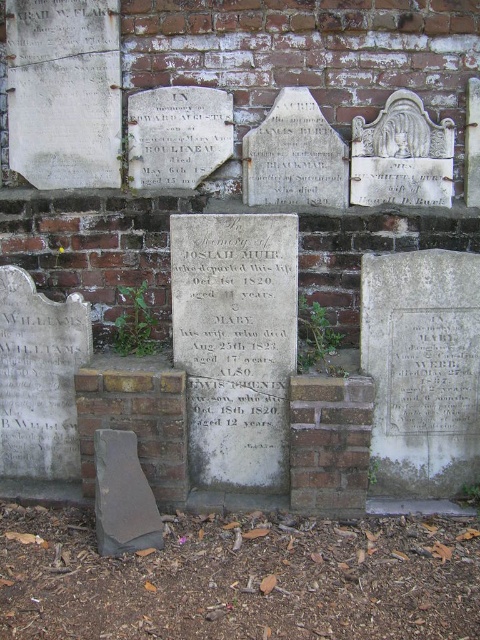
Consider the image. Is gray stone plaque at center to the right of white stone plaque at center from the viewer's perspective?

No, gray stone plaque at center is not to the right of white stone plaque at center.

Can you confirm if gray stone plaque at center is shorter than white stone plaque at center?

In fact, gray stone plaque at center may be taller than white stone plaque at center.

Which is behind, point (285, 330) or point (410, 120)?

The point (410, 120) is behind.

The height and width of the screenshot is (640, 480). What are the coordinates of `gray stone plaque at center` in the screenshot? It's located at (236, 340).

Who is lower down, white stone plaque at center or gray stone gravestone at lower left?

gray stone gravestone at lower left is lower down.

Does white stone plaque at center appear on the left side of gray stone gravestone at lower left?

No, white stone plaque at center is not to the left of gray stone gravestone at lower left.

Identify the location of white stone plaque at center. The width and height of the screenshot is (480, 640). (402, 156).

The height and width of the screenshot is (640, 480). Find the location of `white stone plaque at center`. white stone plaque at center is located at coordinates (402, 156).

Between gray stone plaque at center and gray stone gravestone at lower left, which one has less height?

Standing shorter between the two is gray stone gravestone at lower left.

What do you see at coordinates (236, 340) in the screenshot? I see `gray stone plaque at center` at bounding box center [236, 340].

This screenshot has width=480, height=640. Describe the element at coordinates (236, 340) in the screenshot. I see `gray stone plaque at center` at that location.

Where is `gray stone plaque at center`? The image size is (480, 640). gray stone plaque at center is located at coordinates (236, 340).